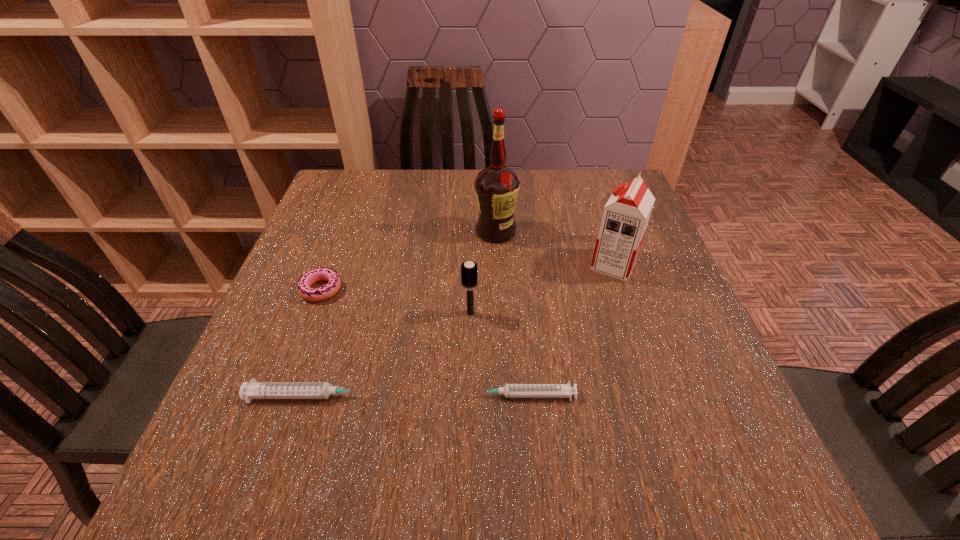
Where is `vacant point located between the doughnut and the tallest object`? Image resolution: width=960 pixels, height=540 pixels. vacant point located between the doughnut and the tallest object is located at coordinates (408, 260).

Where is `vacant space that's between the tallest object and the left syringe`? This screenshot has width=960, height=540. vacant space that's between the tallest object and the left syringe is located at coordinates (403, 314).

You are a GUI agent. You are given a task and a screenshot of the screen. Output one action in this format:
    pyautogui.click(x=<x>, y=<y>)
    Task: Click on the free space between the right syringe and the taller syringe
    Image resolution: width=960 pixels, height=540 pixels.
    Given the screenshot: What is the action you would take?
    pyautogui.click(x=416, y=396)

I want to click on vacant space in between the taller syringe and the rightmost object, so click(x=462, y=330).

Identify the location of object that can be found as the closest to the doughnut. (253, 390).

Select which object is the third closest to the doughnut. Please provide its 2D coordinates. Your answer should be formatted as a tuple, i.e. [(x, y)], where the tuple contains the x and y coordinates of a point satisfying the conditions above.

[(496, 187)]

This screenshot has height=540, width=960. In order to click on free space in the image that satisfies the following two spatial constraints: 1. on the front side of the fifth shortest object; 2. at the needle end of the right syringe in this screenshot , I will do `click(658, 395)`.

At what (x,y) coordinates should I click in order to perform the action: click on blank space that satisfies the following two spatial constraints: 1. on the label of the second tallest object; 2. on the left side of the alcohol. Please return your answer as a coordinate pair (x, y). Looking at the image, I should click on (497, 265).